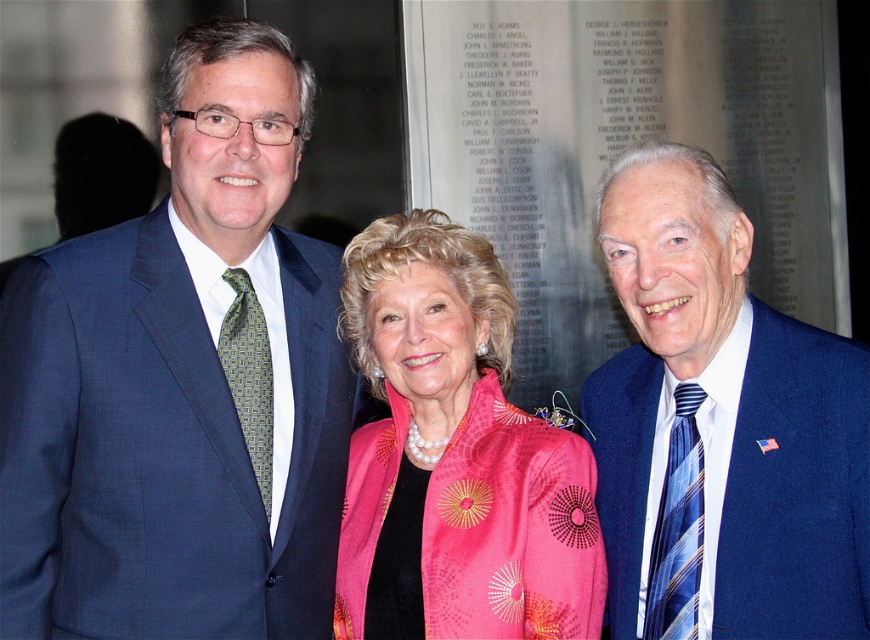
You are a photographer setting up for a group photo. You need to ensure that the matte blue suit at left and the greengeometric patterned fabrictie at left are both in focus. Which object should you focus on first to ensure both are sharp?

The matte blue suit at left is closer to the viewer than the greengeometric patterned fabrictie at left. To ensure both are in focus, you should focus on the matte blue suit at left first, as it is closer, and the depth of field will naturally include the farther object.

You are a tailor observing three people in front of a glass panel. You need to determine which tie, the blue striped tie at right or the greengeometric patterned fabrictie at left, is bigger in size. Based on the scene, which one is larger?

The blue striped tie at right is larger in size compared to the greengeometric patterned fabrictie at left.